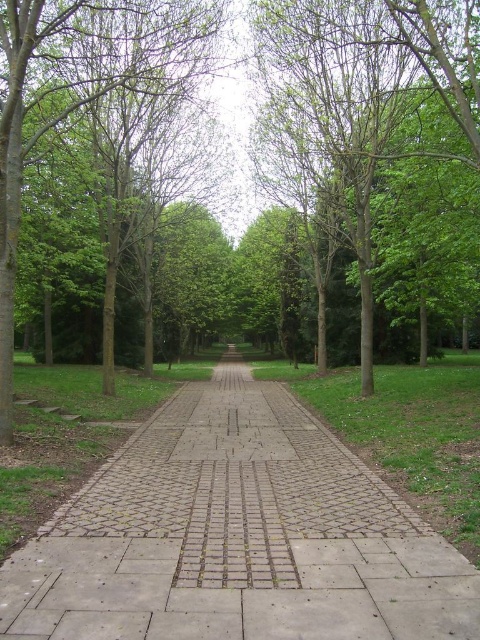
Does point (392, 28) come behind point (432, 396)?

Yes, point (392, 28) is farther from viewer.

Which is below, green leafy tree at center or green grass at center?

green grass at center

The image size is (480, 640). In order to click on green leafy tree at center in this screenshot , I will do `click(372, 97)`.

The height and width of the screenshot is (640, 480). I want to click on green leafy tree at center, so click(372, 97).

Is point (264, 440) more distant than point (403, 476)?

Yes, point (264, 440) is farther from viewer.

Who is positioned more to the right, gray concrete pavement at center or green grass at center?

green grass at center is more to the right.

Find the location of a particular element. Image resolution: width=480 pixels, height=640 pixels. gray concrete pavement at center is located at coordinates (237, 536).

Find the location of a particular element. This screenshot has height=640, width=480. gray concrete pavement at center is located at coordinates (237, 536).

Can you confirm if green leafy tree at left is shorter than green grass at center?

No.

This screenshot has height=640, width=480. What do you see at coordinates (82, 92) in the screenshot?
I see `green leafy tree at left` at bounding box center [82, 92].

Who is more distant from viewer, (58, 115) or (350, 436)?

The point (58, 115) is more distant.

At what (x,y) coordinates should I click in order to perform the action: click on green leafy tree at left. Please return your answer as a coordinate pair (x, y). The image size is (480, 640). Looking at the image, I should click on (82, 92).